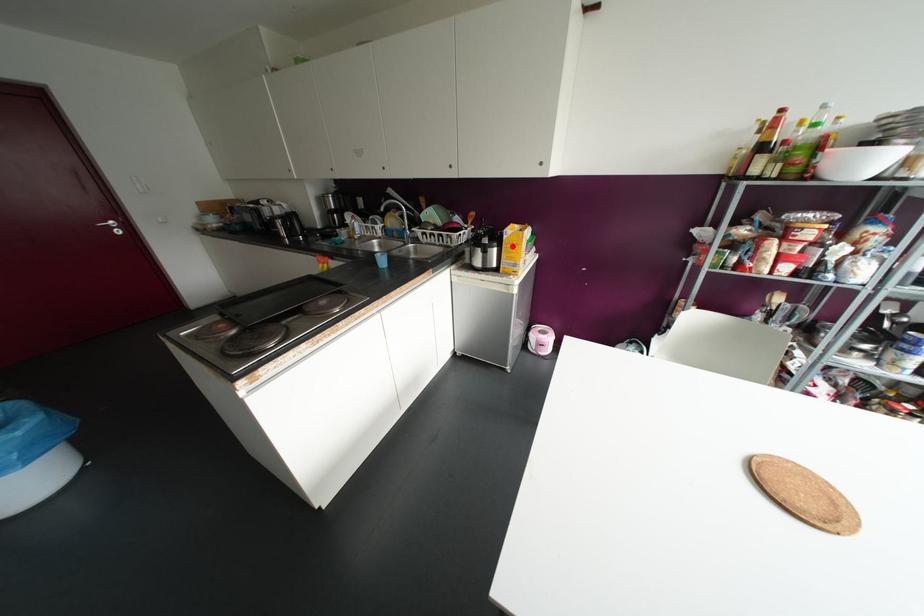
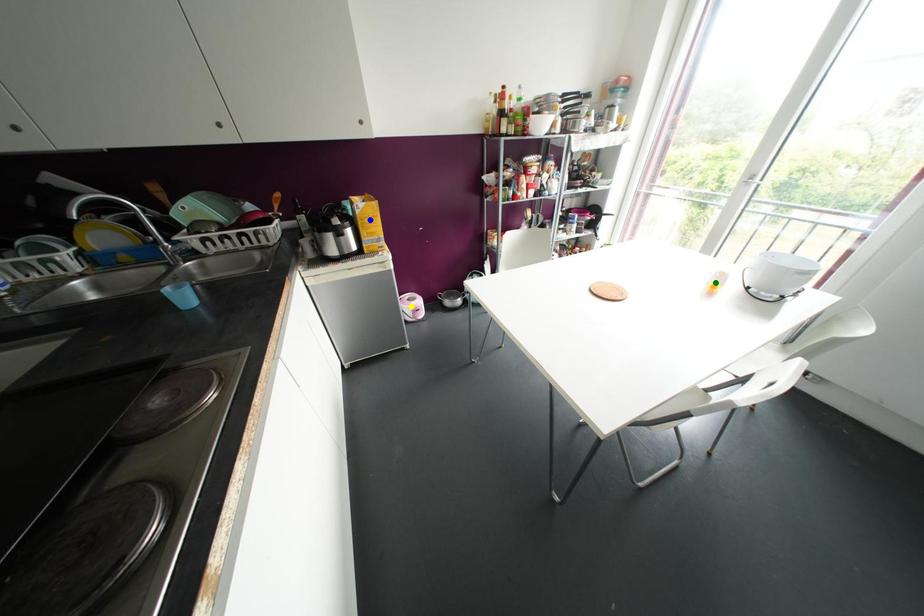
Question: I am providing you with two images of the same scene from different viewpoints. A red point is marked on the first image. You are given multiple points on the second image. Which point in image 2 is actually the same real-world point as the red point in image 1?

Choices:
 (A) blue point
 (B) yellow point
 (C) green point

Answer: (A)